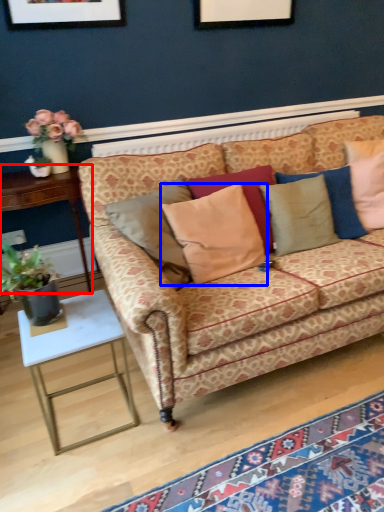
Question: Which point is further to the camera, table (highlighted by a red box) or pillow (highlighted by a blue box)?

Choices:
 (A) table
 (B) pillow

Answer: (A)